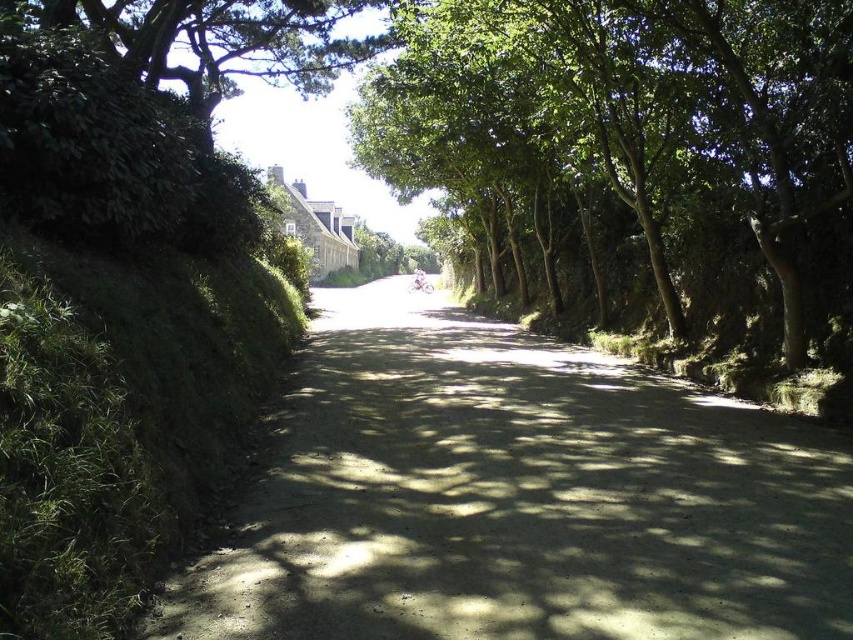
You are a hiker trying to decide whether to walk along the dirt road at center or under the green leafy tree at upper left for shade. Which path covers more area?

The green leafy tree at upper left occupies more space than the dirt road at center, so it covers a larger area and might provide more shade.

Looking at this image, you are a hiker standing on the dirt road and want to take a photo of the green leafy tree at center and the green leafy tree at upper left. Which tree should you move closer to in order to frame both trees in your camera viewfinder without zooming?

You should move closer to the green leafy tree at center because it is shorter than the green leafy tree at upper left, so getting nearer to the shorter tree will help balance their sizes in the frame.

You are a cyclist riding along the dirt road at center. You notice a green leafy tree at center nearby. Which object occupies more space horizontally in the scene?

The green leafy tree at center occupies more horizontal space than the dirt road at center because the dirt road at center is thinner than the green leafy tree at center.